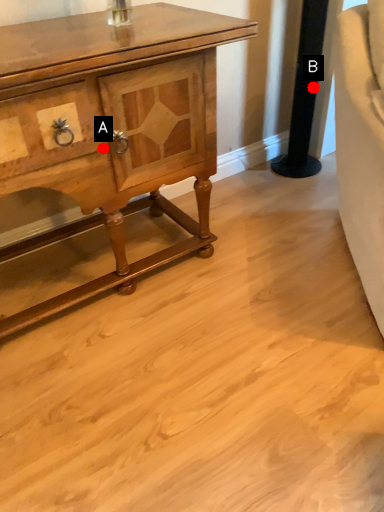
Question: Two points are circled on the image, labeled by A and B beside each circle. Which point is closer to the camera taking this photo?

Choices:
 (A) A is closer
 (B) B is closer

Answer: (A)